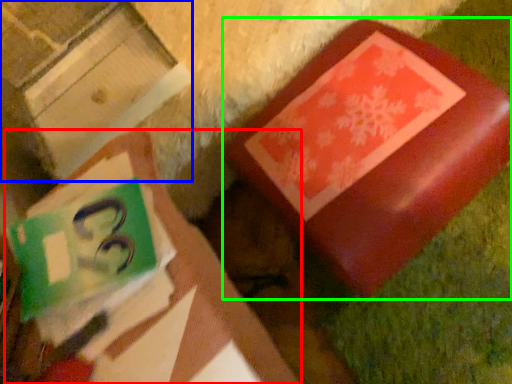
Question: Which object is the closest to the book (highlighted by a red box)? Choose among these: cardboard box (highlighted by a blue box) or furniture (highlighted by a green box).

Choices:
 (A) cardboard box
 (B) furniture

Answer: (B)